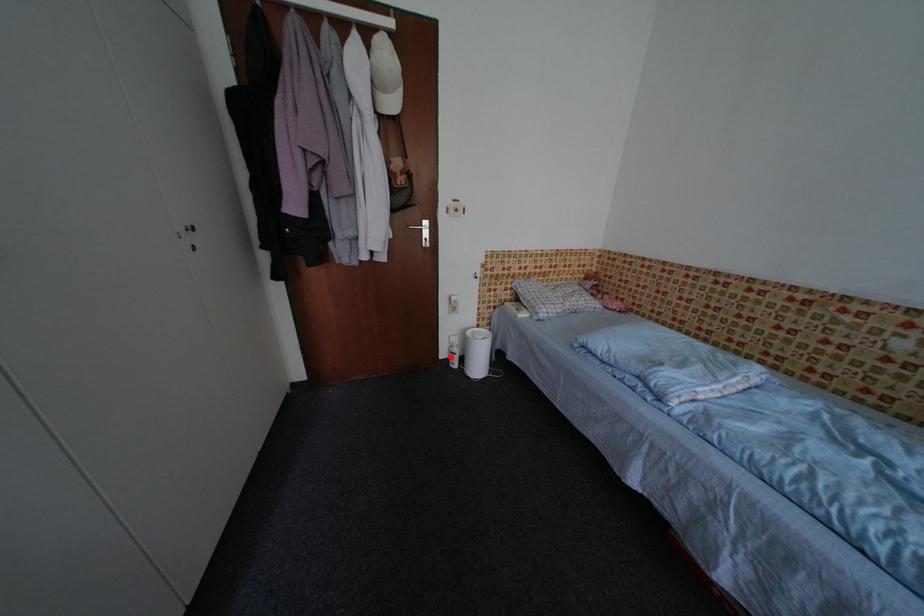
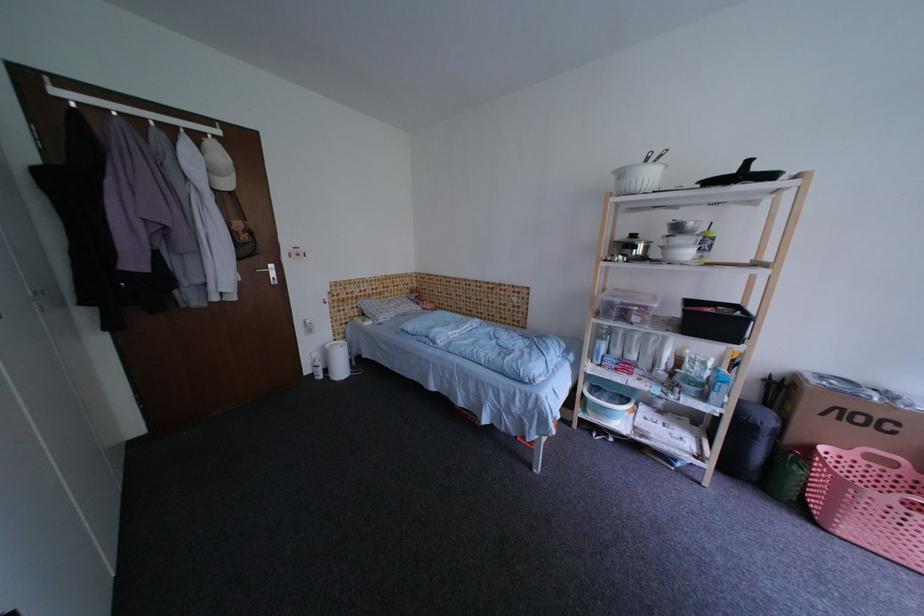
Question: A red point is marked in image1. In image2, is the corresponding 3D point closer to the camera or farther? Reply with the corresponding letter.

Choices:
 (A) The corresponding 3D point is closer.
 (B) The corresponding 3D point is farther.

Answer: (A)